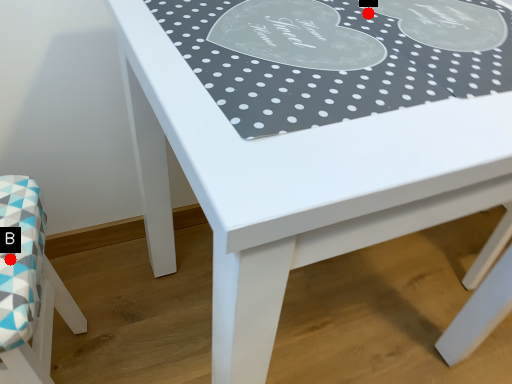
Question: Two points are circled on the image, labeled by A and B beside each circle. Which point is closer to the camera?

Choices:
 (A) A is closer
 (B) B is closer

Answer: (B)